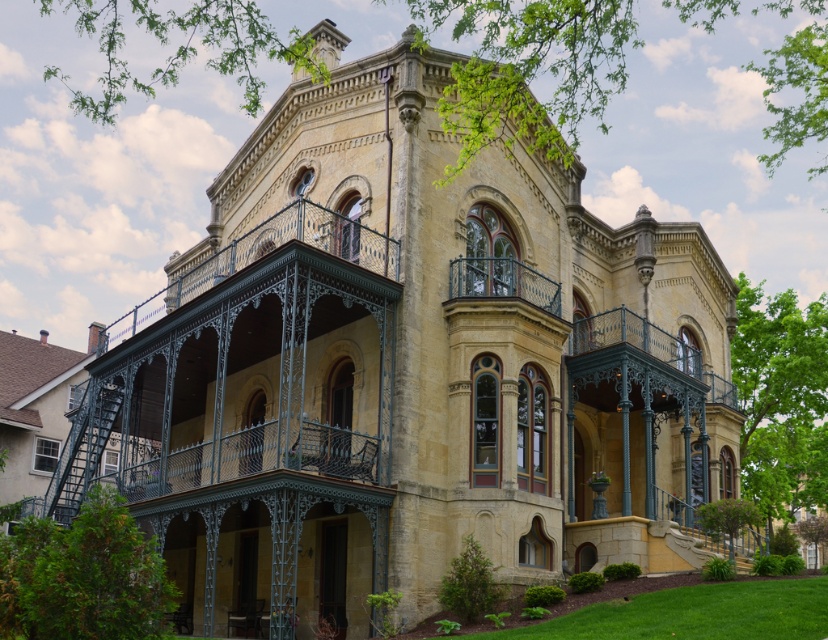
Which of these two, green wrought iron balcony at center or polished wrought iron balcony at center, stands taller?

With more height is green wrought iron balcony at center.

Does green wrought iron balcony at center lie in front of polished wrought iron balcony at center?

No, it is behind polished wrought iron balcony at center.

Between point (604, 324) and point (525, 275), which one is positioned in front?

Point (525, 275) is more forward.

This screenshot has height=640, width=828. What are the coordinates of `green wrought iron balcony at center` in the screenshot? It's located at (648, 348).